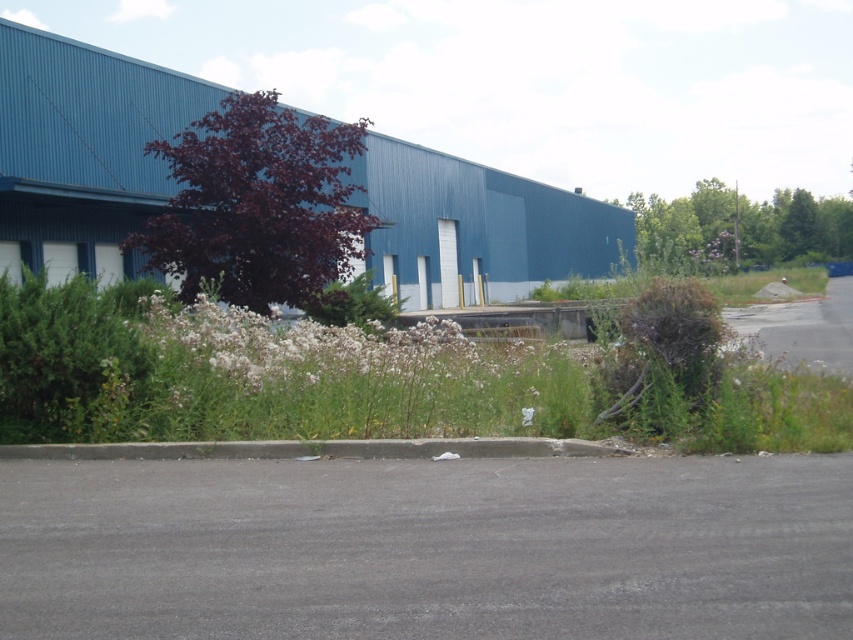
Question: Which object is the farthest from the white fluffy flowers at center?

Choices:
 (A) green grass at center
 (B) purple leafy plant at center-left

Answer: (A)

Question: Is purple leafy plant at center-left bigger than white fluffy flowers at center?

Choices:
 (A) no
 (B) yes

Answer: (B)

Question: From the image, what is the correct spatial relationship of purple leafy plant at center-left in relation to white fluffy flowers at center?

Choices:
 (A) left
 (B) right

Answer: (A)

Question: Among these points, which one is farthest from the camera?

Choices:
 (A) (155, 323)
 (B) (297, 124)
 (C) (750, 289)

Answer: (C)

Question: Which object is positioned farthest from the green grass at center?

Choices:
 (A) white fluffy flowers at center
 (B) purple leafy plant at center-left

Answer: (A)

Question: Is white fluffy flowers at center wider than green grass at center?

Choices:
 (A) yes
 (B) no

Answer: (B)